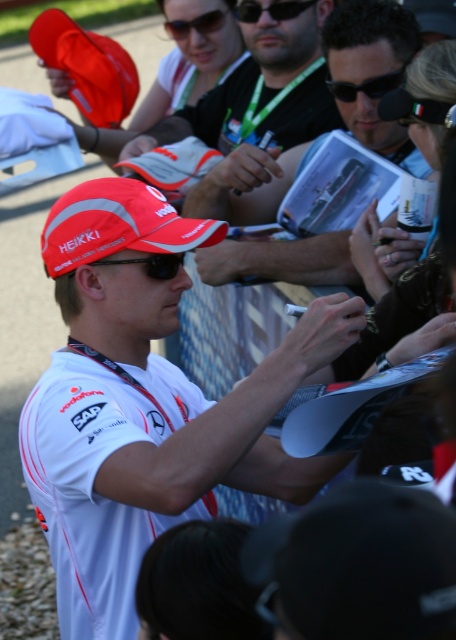
Looking at the scene, where is the black plastic sunglasses at center relative to the red reflective cap at center?

The black plastic sunglasses at center are to the right of the red reflective cap at center.

Looking at this image, you are a photographer at the event and need to ensure both the white matte shirt at center and the black plastic sunglasses at upper center are visible in your photo. Given their sizes, which object will occupy more space in the frame?

The white matte shirt at center occupies more space in the frame because it has a larger size compared to the black plastic sunglasses at upper center.

Based on the scene description, where is the white matte shirt at center located in terms of coordinates?

The white matte shirt at center is located at point coordinates of 0.062 in the x axis and 0.809 in the y axis.